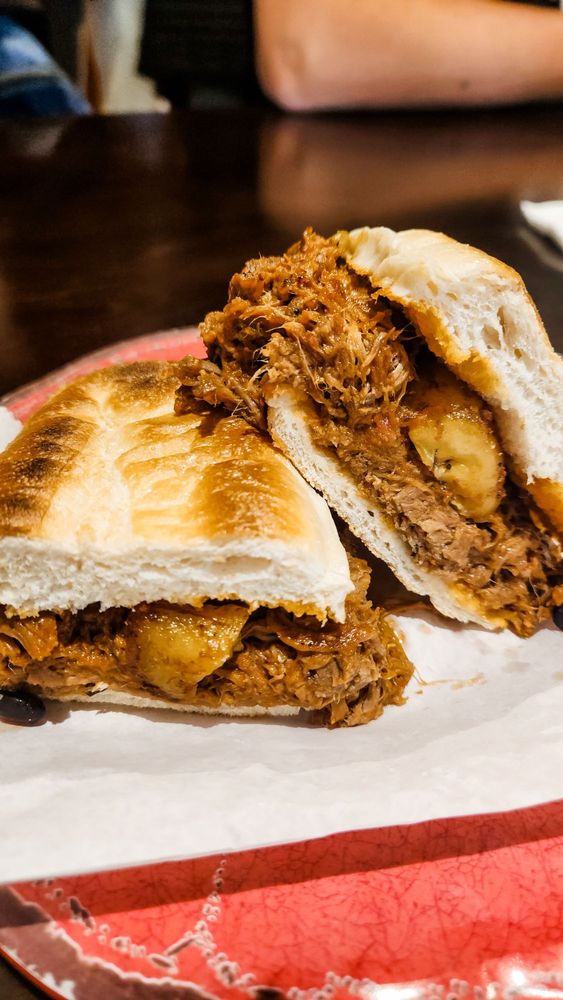
Identify the location of plate. (417, 905).